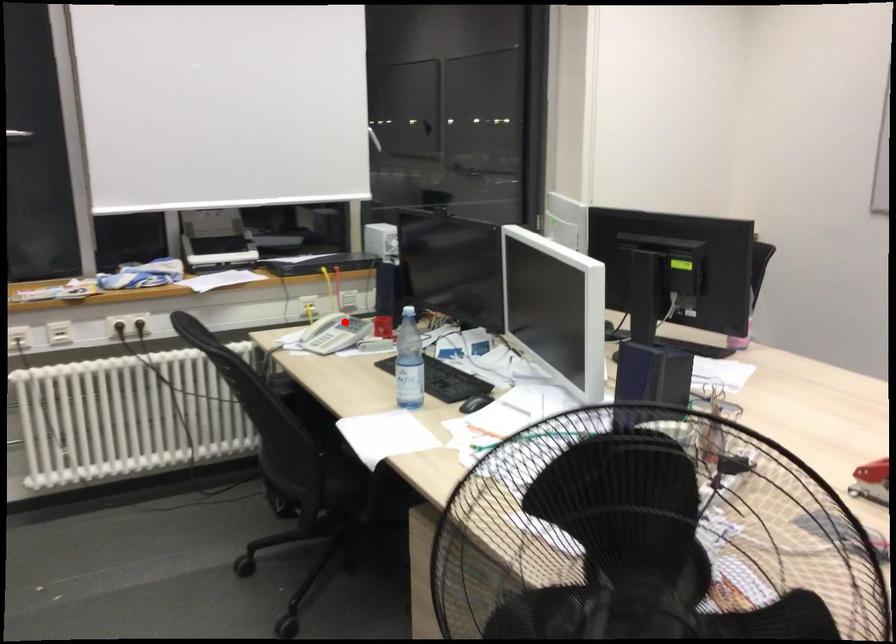
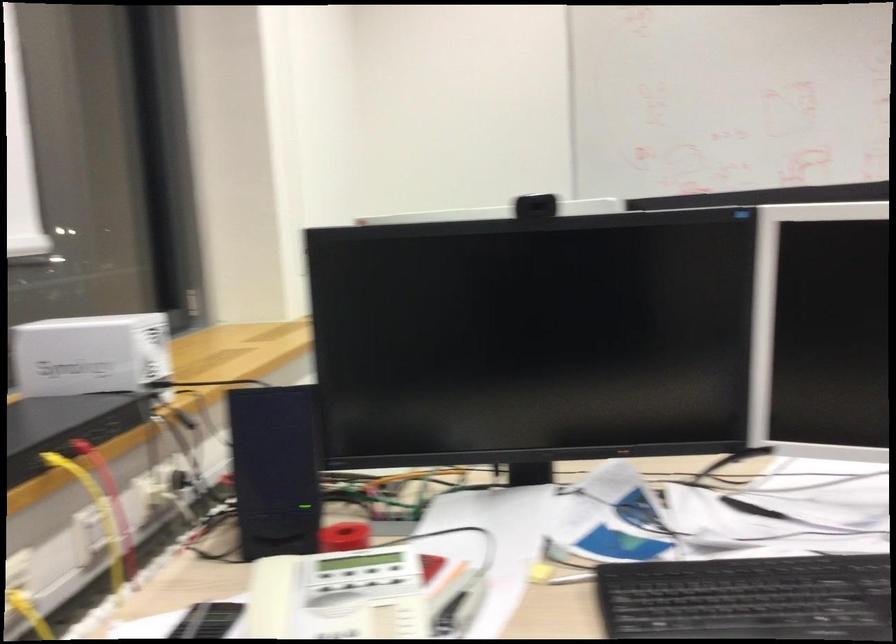
In the second image, find the point that corresponds to the highlighted location in the first image.

(373, 590)